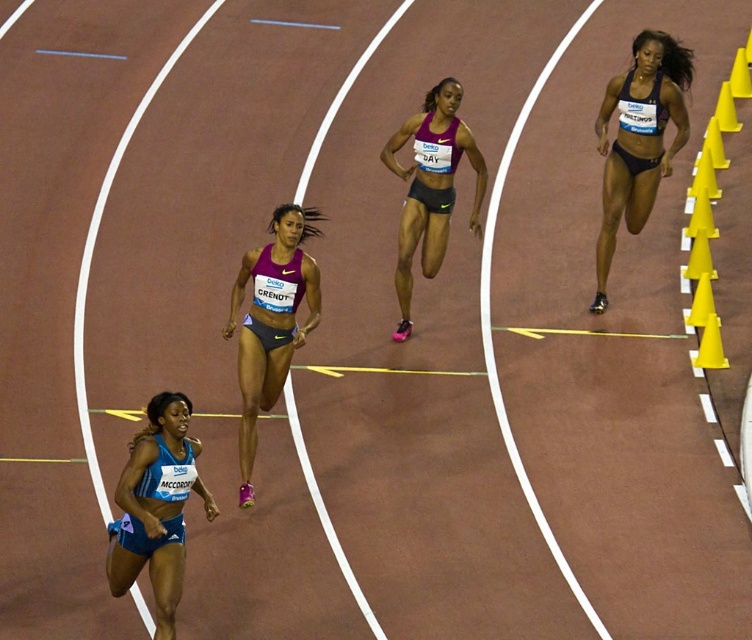
Does dark blue fabric shorts at right have a smaller size compared to purple matte shorts at center?

No, dark blue fabric shorts at right is not smaller than purple matte shorts at center.

Does dark blue fabric shorts at right lie behind purple matte shorts at center?

Yes, dark blue fabric shorts at right is behind purple matte shorts at center.

Which is behind, point (605, 237) or point (453, 90)?

Point (605, 237)

Image resolution: width=752 pixels, height=640 pixels. In order to click on dark blue fabric shorts at right in this screenshot , I will do `click(638, 140)`.

Is blue fabric shorts at lower left thinner than purple matte shorts at center?

Indeed, blue fabric shorts at lower left has a lesser width compared to purple matte shorts at center.

Who is higher up, blue fabric shorts at lower left or purple matte shorts at center?

purple matte shorts at center

Between point (138, 557) and point (408, 234), which one is positioned behind?

Point (408, 234)

What are the coordinates of `blue fabric shorts at lower left` in the screenshot? It's located at (156, 508).

Can you confirm if blue fabric shorts at lower left is bigger than matte purple tank top at center?

No.

Does point (147, 536) lie in front of point (256, 314)?

Yes, point (147, 536) is in front of point (256, 314).

The height and width of the screenshot is (640, 752). In order to click on blue fabric shorts at lower left in this screenshot , I will do `click(156, 508)`.